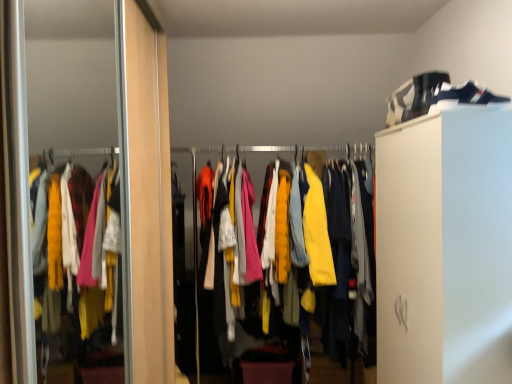
Question: From a real-world perspective, does matte yellow jackets at center sit lower than camouflage fabric shoe at upper right?

Choices:
 (A) no
 (B) yes

Answer: (B)

Question: Can you confirm if matte yellow jackets at center is shorter than camouflage fabric shoe at upper right?

Choices:
 (A) yes
 (B) no

Answer: (B)

Question: Considering the relative positions of matte yellow jackets at center and camouflage fabric shoe at upper right in the image provided, is matte yellow jackets at center to the right of camouflage fabric shoe at upper right from the viewer's perspective?

Choices:
 (A) yes
 (B) no

Answer: (B)

Question: Is matte yellow jackets at center oriented away from camouflage fabric shoe at upper right?

Choices:
 (A) yes
 (B) no

Answer: (B)

Question: Is matte yellow jackets at center taller than camouflage fabric shoe at upper right?

Choices:
 (A) no
 (B) yes

Answer: (B)

Question: Are matte yellow jackets at center and camouflage fabric shoe at upper right beside each other?

Choices:
 (A) yes
 (B) no

Answer: (B)

Question: Are camouflage fabric shoe at upper right and wooden screen door at left beside each other?

Choices:
 (A) no
 (B) yes

Answer: (A)

Question: Is wooden screen door at left completely or partially inside camouflage fabric shoe at upper right?

Choices:
 (A) yes
 (B) no

Answer: (B)

Question: From a real-world perspective, does camouflage fabric shoe at upper right sit lower than wooden screen door at left?

Choices:
 (A) no
 (B) yes

Answer: (A)

Question: From a real-world perspective, is camouflage fabric shoe at upper right on wooden screen door at left?

Choices:
 (A) yes
 (B) no

Answer: (A)

Question: Does camouflage fabric shoe at upper right lie behind wooden screen door at left?

Choices:
 (A) yes
 (B) no

Answer: (A)

Question: Can you confirm if camouflage fabric shoe at upper right is smaller than wooden screen door at left?

Choices:
 (A) yes
 (B) no

Answer: (A)

Question: Could wooden screen door at left be considered to be inside matte yellow jackets at center?

Choices:
 (A) no
 (B) yes

Answer: (A)